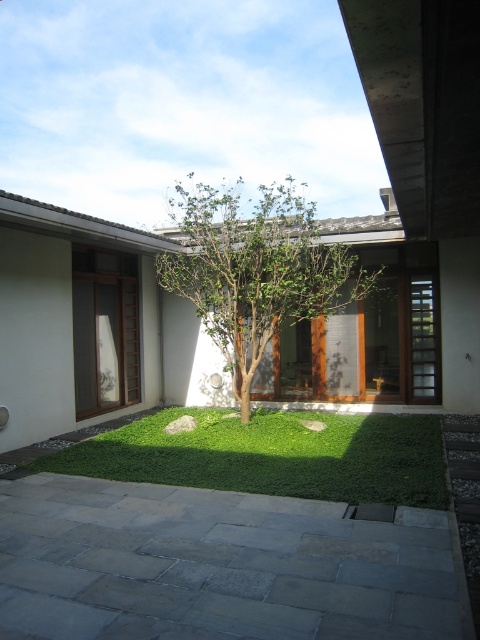
Question: Which of the following is the farthest from the observer?

Choices:
 (A) green leafy grass at center
 (B) green leafy tree at center

Answer: (B)

Question: Is green leafy grass at center wider than green leafy tree at center?

Choices:
 (A) no
 (B) yes

Answer: (A)

Question: Which point appears farthest from the camera in this image?

Choices:
 (A) (x=105, y=451)
 (B) (x=200, y=214)

Answer: (B)

Question: Which of the following is the farthest from the observer?

Choices:
 (A) green leafy grass at center
 (B) green leafy tree at center

Answer: (B)

Question: Can you confirm if green leafy grass at center is positioned to the right of green leafy tree at center?

Choices:
 (A) yes
 (B) no

Answer: (B)

Question: Is green leafy grass at center thinner than green leafy tree at center?

Choices:
 (A) yes
 (B) no

Answer: (A)